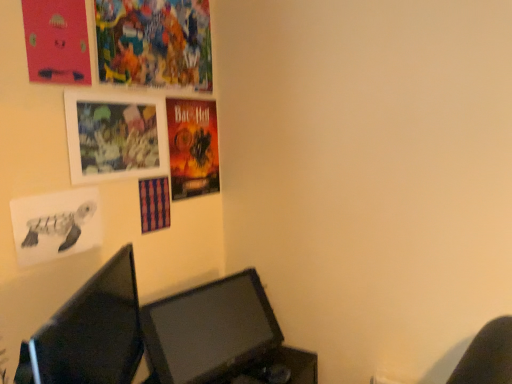
The height and width of the screenshot is (384, 512). What do you see at coordinates (56, 224) in the screenshot?
I see `black paper turtle at lower left, which ranks as the 3th poster page in top-to-bottom order` at bounding box center [56, 224].

In order to face matte pink poster at upper left, which ranks as the 2th poster page in top-to-bottom order, should I rotate leftwards or rightwards?

You should rotate left by 24.556 degrees.

Consider the image. What is the approximate width of matte black monitor at lower left, which is the second computer monitor from back to front?

8.65 inches.

The height and width of the screenshot is (384, 512). What do you see at coordinates (115, 136) in the screenshot? I see `matte plastic picture frame at upper left` at bounding box center [115, 136].

At what (x,y) coordinates should I click in order to perform the action: click on black paper turtle at lower left, which ranks as the 3th poster page in top-to-bottom order. Please return your answer as a coordinate pair (x, y). The width and height of the screenshot is (512, 384). Looking at the image, I should click on (56, 224).

Is vibrant paper poster at upper left, which is the third poster page from bottom to top, wider than matte plastic picture frame at upper left?

In fact, vibrant paper poster at upper left, which is the third poster page from bottom to top, might be narrower than matte plastic picture frame at upper left.

The width and height of the screenshot is (512, 384). Find the location of `picture frame in front of the vibrant paper poster at upper left, the first poster page in the top-to-bottom sequence`. picture frame in front of the vibrant paper poster at upper left, the first poster page in the top-to-bottom sequence is located at coordinates (115, 136).

Visually, is vibrant paper poster at upper left, the first poster page in the top-to-bottom sequence, positioned to the left or to the right of matte plastic picture frame at upper left?

Clearly, vibrant paper poster at upper left, the first poster page in the top-to-bottom sequence, is on the right of matte plastic picture frame at upper left in the image.

Is vibrant paper poster at upper left, which is the third poster page from bottom to top, oriented away from matte plastic picture frame at upper left?

vibrant paper poster at upper left, which is the third poster page from bottom to top, is not turned away from matte plastic picture frame at upper left.

From a real-world perspective, which object rests below the other?

matte black monitor at lower center, marked as the 2th computer monitor in a front-to-back arrangement.

From the image's perspective, is matte black monitor at lower center, the first computer monitor in the back-to-front sequence, located above matte black monitor at lower left, which is the 1th computer monitor in front-to-back order?

No.

Find the location of `computer monitor above the matte black monitor at lower center, marked as the 2th computer monitor in a front-to-back arrangement (from the image's perspective)`. computer monitor above the matte black monitor at lower center, marked as the 2th computer monitor in a front-to-back arrangement (from the image's perspective) is located at coordinates (93, 331).

Where is `picture frame that is above the matte black monitor at lower center, marked as the 2th computer monitor in a front-to-back arrangement (from a real-world perspective)`? The width and height of the screenshot is (512, 384). picture frame that is above the matte black monitor at lower center, marked as the 2th computer monitor in a front-to-back arrangement (from a real-world perspective) is located at coordinates (115, 136).

Does matte black monitor at lower center, the first computer monitor in the back-to-front sequence, have a larger size compared to matte plastic picture frame at upper left?

Yes.

What's the angular difference between matte black monitor at lower center, marked as the 2th computer monitor in a front-to-back arrangement, and matte plastic picture frame at upper left's facing directions?

11 degrees.

Is point (72, 133) behind point (228, 300)?

No.

From a real-world perspective, between matte plastic picture frame at upper left and matte black monitor at lower center, marked as the 2th computer monitor in a front-to-back arrangement, who is vertically higher?

From a 3D spatial view, matte plastic picture frame at upper left is above.

Is matte plastic picture frame at upper left turned away from matte black monitor at lower center, marked as the 2th computer monitor in a front-to-back arrangement?

No, matte plastic picture frame at upper left is not facing the opposite direction of matte black monitor at lower center, marked as the 2th computer monitor in a front-to-back arrangement.

Is matte plastic picture frame at upper left smaller than matte black monitor at lower center, the first computer monitor in the back-to-front sequence?

Correct, matte plastic picture frame at upper left occupies less space than matte black monitor at lower center, the first computer monitor in the back-to-front sequence.

From the picture: From the image's perspective, is matte black monitor at lower center, marked as the 2th computer monitor in a front-to-back arrangement, on vibrant paper poster at upper left, which is the third poster page from bottom to top?

Actually, matte black monitor at lower center, marked as the 2th computer monitor in a front-to-back arrangement, appears below vibrant paper poster at upper left, which is the third poster page from bottom to top, in the image.

Is point (170, 365) closer or farther from the camera than point (182, 42)?

Point (170, 365) is closer to the camera than point (182, 42).

Who is bigger, matte black monitor at lower center, marked as the 2th computer monitor in a front-to-back arrangement, or vibrant paper poster at upper left, which is the third poster page from bottom to top?

matte black monitor at lower center, marked as the 2th computer monitor in a front-to-back arrangement.

From the image's perspective, which one is positioned lower, shiny paper poster at upper center or vibrant paper poster at upper left, which is the third poster page from bottom to top?

shiny paper poster at upper center is shown below in the image.

Is shiny paper poster at upper center touching vibrant paper poster at upper left, the first poster page in the top-to-bottom sequence?

shiny paper poster at upper center is not next to vibrant paper poster at upper left, the first poster page in the top-to-bottom sequence, and they're not touching.

Is point (197, 130) positioned before point (157, 31)?

No, it is behind (157, 31).

Considering the relative sizes of shiny paper poster at upper center and vibrant paper poster at upper left, which is the third poster page from bottom to top, in the image provided, is shiny paper poster at upper center thinner than vibrant paper poster at upper left, which is the third poster page from bottom to top,?

In fact, shiny paper poster at upper center might be wider than vibrant paper poster at upper left, which is the third poster page from bottom to top.

Is matte pink poster at upper left, the 2th poster page positioned from the bottom, turned away from black paper turtle at lower left, arranged as the 1th poster page when ordered from the bottom?

No.

Is point (27, 4) positioned in front of point (28, 260)?

Yes, point (27, 4) is closer to viewer.

From their relative heights in the image, would you say matte pink poster at upper left, which ranks as the 2th poster page in top-to-bottom order, is taller or shorter than black paper turtle at lower left, arranged as the 1th poster page when ordered from the bottom?

Considering their sizes, matte pink poster at upper left, which ranks as the 2th poster page in top-to-bottom order, has more height than black paper turtle at lower left, arranged as the 1th poster page when ordered from the bottom.

From a real-world perspective, relative to black paper turtle at lower left, which ranks as the 3th poster page in top-to-bottom order, is matte pink poster at upper left, the 2th poster page positioned from the bottom, vertically above or below?

Clearly, from a real-world perspective, matte pink poster at upper left, the 2th poster page positioned from the bottom, is above black paper turtle at lower left, which ranks as the 3th poster page in top-to-bottom order.

From the image's perspective, which poster page is the 2nd one above the matte plastic picture frame at upper left? Please provide its 2D coordinates.

[(154, 43)]

At what (x,y) coordinates should I click in order to perform the action: click on computer monitor that appears in front of the matte black monitor at lower center, the first computer monitor in the back-to-front sequence. Please return your answer as a coordinate pair (x, y). Looking at the image, I should click on (93, 331).

Looking at the image, which one is located further to matte pink poster at upper left, the 2th poster page positioned from the bottom, black paper turtle at lower left, which ranks as the 3th poster page in top-to-bottom order, or matte plastic picture frame at upper left?

Among the two, black paper turtle at lower left, which ranks as the 3th poster page in top-to-bottom order, is located further to matte pink poster at upper left, the 2th poster page positioned from the bottom.

Which object lies further to the anchor point matte black monitor at lower center, the first computer monitor in the back-to-front sequence, black paper turtle at lower left, arranged as the 1th poster page when ordered from the bottom, or matte black monitor at lower left, which is the second computer monitor from back to front?

black paper turtle at lower left, arranged as the 1th poster page when ordered from the bottom, is positioned further to the anchor matte black monitor at lower center, the first computer monitor in the back-to-front sequence.

Which object lies nearer to the anchor point matte black monitor at lower center, the first computer monitor in the back-to-front sequence, shiny paper poster at upper center or matte plastic picture frame at upper left?

shiny paper poster at upper center is positioned closer to the anchor matte black monitor at lower center, the first computer monitor in the back-to-front sequence.

From the image, which object appears to be nearer to matte pink poster at upper left, which ranks as the 2th poster page in top-to-bottom order, matte plastic picture frame at upper left or matte black monitor at lower left, which is the 1th computer monitor in front-to-back order?

matte plastic picture frame at upper left is closer to matte pink poster at upper left, which ranks as the 2th poster page in top-to-bottom order.

In the scene shown: Which object lies further to the anchor point black paper turtle at lower left, which ranks as the 3th poster page in top-to-bottom order, matte plastic picture frame at upper left or matte black monitor at lower left, which is the second computer monitor from back to front?

matte black monitor at lower left, which is the second computer monitor from back to front, is positioned further to the anchor black paper turtle at lower left, which ranks as the 3th poster page in top-to-bottom order.

Based on their spatial positions, is vibrant paper poster at upper left, the first poster page in the top-to-bottom sequence, or black paper turtle at lower left, which ranks as the 3th poster page in top-to-bottom order, closer to matte pink poster at upper left, which ranks as the 2th poster page in top-to-bottom order?

Among the two, vibrant paper poster at upper left, the first poster page in the top-to-bottom sequence, is located nearer to matte pink poster at upper left, which ranks as the 2th poster page in top-to-bottom order.

Estimate the real-world distances between objects in this image. Which object is further from matte pink poster at upper left, the 2th poster page positioned from the bottom, shiny paper poster at upper center or matte plastic picture frame at upper left?

shiny paper poster at upper center.

Estimate the real-world distances between objects in this image. Which object is closer to black paper turtle at lower left, which ranks as the 3th poster page in top-to-bottom order, vibrant paper poster at upper left, which is the third poster page from bottom to top, or matte plastic picture frame at upper left?

Among the two, matte plastic picture frame at upper left is located nearer to black paper turtle at lower left, which ranks as the 3th poster page in top-to-bottom order.

This screenshot has width=512, height=384. Identify the location of poster between vibrant paper poster at upper left, which is the third poster page from bottom to top, and black paper turtle at lower left, arranged as the 1th poster page when ordered from the bottom, in the up-down direction. (192, 147).

Find the location of a particular element. picture frame between vibrant paper poster at upper left, which is the third poster page from bottom to top, and matte black monitor at lower left, which is the second computer monitor from back to front, in the vertical direction is located at coordinates (115, 136).

The height and width of the screenshot is (384, 512). I want to click on picture frame between black paper turtle at lower left, arranged as the 1th poster page when ordered from the bottom, and shiny paper poster at upper center, along the z-axis, so click(115, 136).

Locate an element on the screen. This screenshot has width=512, height=384. poster page between vibrant paper poster at upper left, the first poster page in the top-to-bottom sequence, and black paper turtle at lower left, which ranks as the 3th poster page in top-to-bottom order, vertically is located at coordinates (57, 41).